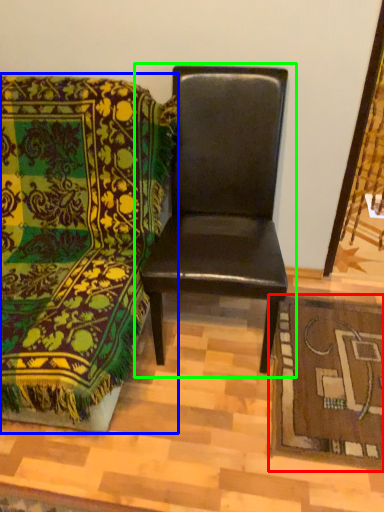
Question: Based on their relative distances, which object is nearer to mat (highlighted by a red box)? Choose from chair (highlighted by a blue box) and chair (highlighted by a green box).

Choices:
 (A) chair
 (B) chair

Answer: (B)